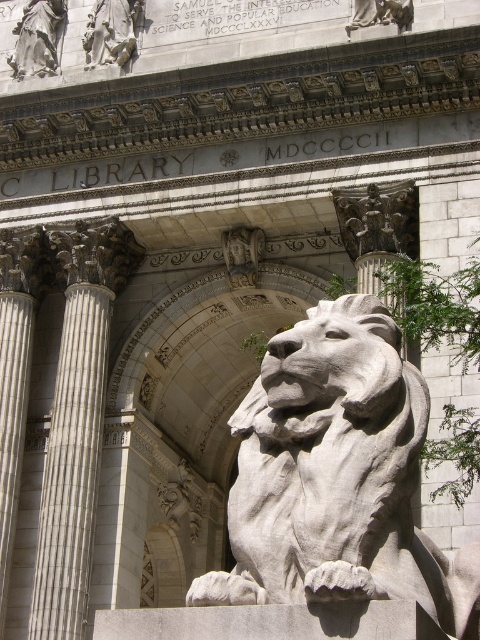
You are standing at the entrance of the New York Public Library and want to take a photo of the white stone lion at center. Based on its position coordinates, where should you aim your camera?

The white stone lion at center is located at coordinates point [336,476], so aim your camera towards that position to capture it.

You are standing in front of the New York Public Library and want to take a photo of both the white marble column at left and the white marble statue at center. Which object should you focus on first to ensure both are in the frame?

You should focus on the white marble column at left first because it is closer to you than the white marble statue at center, ensuring both are in the frame.

You are an architect assessing the New York Public Library facade. You notice two statues at the center. Which one is wider, the white stone lion at center or the white marble statue at center?

The white stone lion at center is wider than the white marble statue at center according to the description.